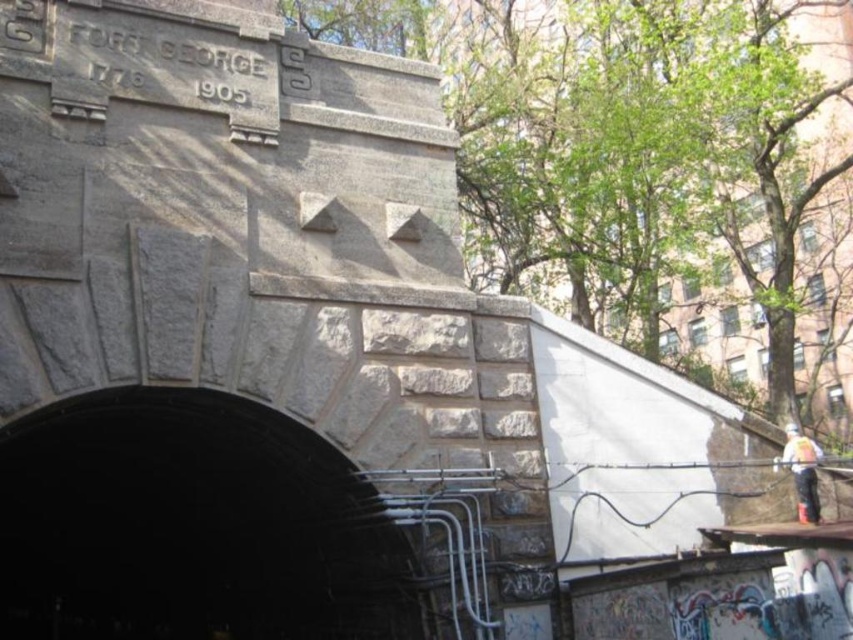
You are a delivery person carrying a large package that is as wide as the white plastic bag at right. You need to enter the dark gray stone tunnel at center. Based on the scene, will your package fit through the tunnel?

The dark gray stone tunnel at center is wider than the white plastic bag at right, so the package, which is as wide as the white plastic bag at right, will fit through the tunnel.

You are standing at the entrance of the tunnel and want to know which of the two points, point (82, 612) or point (807, 445), is closer to you. Can you determine this based on their positions?

Point (82, 612) is further to the camera than point (807, 445), so the closer point to you is point (807, 445).